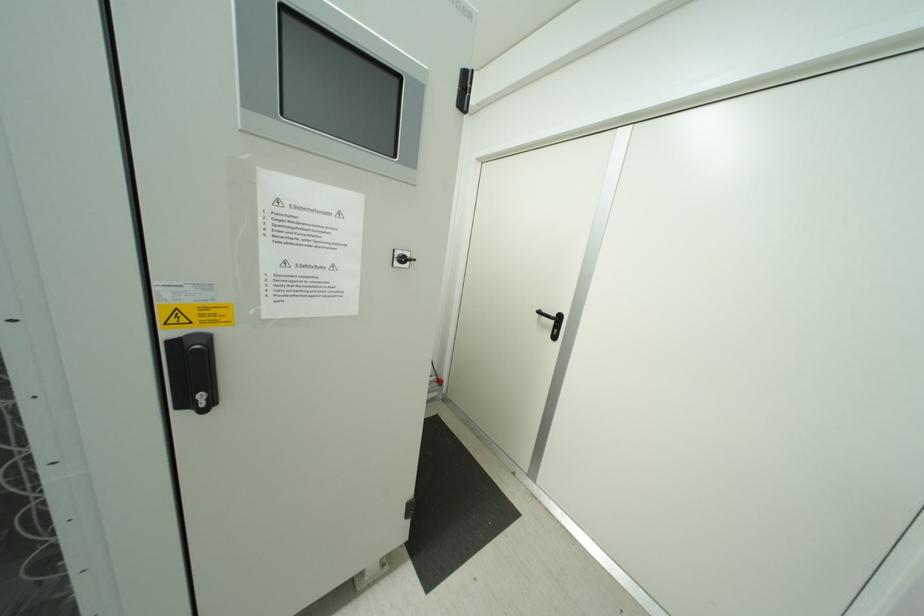
Describe the element at coordinates (402, 257) in the screenshot. I see `the keyed switch` at that location.